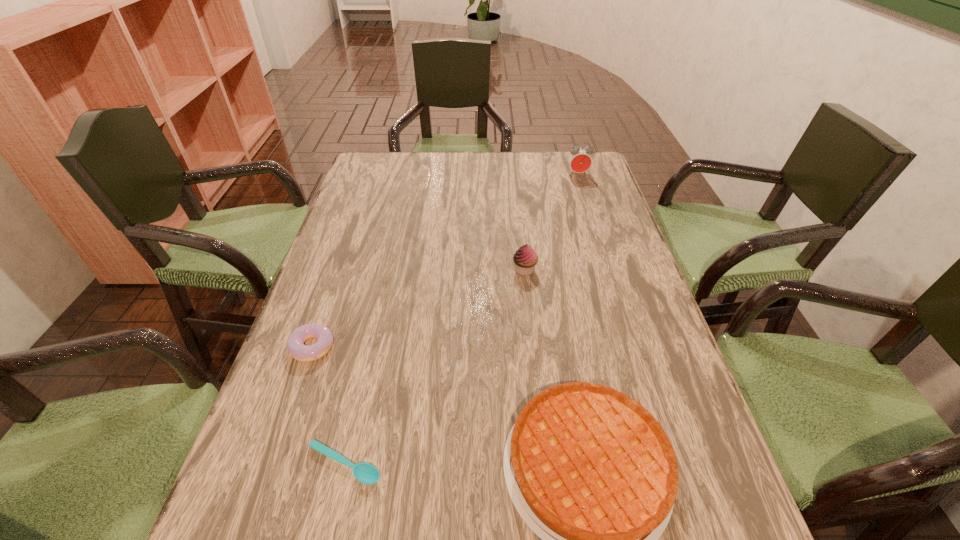
Locate an element on the screen. The image size is (960, 540). vacant area located on the front of the fourth tallest object is located at coordinates (276, 454).

Identify the location of vacant space located 0.370m on the right of the second object from left to right. (596, 464).

You are a GUI agent. You are given a task and a screenshot of the screen. Output one action in this format:
    pyautogui.click(x=<x>, y=<y>)
    Task: Click on the object that is positioned at the far edge
    Image resolution: width=960 pixels, height=540 pixels.
    Given the screenshot: What is the action you would take?
    pyautogui.click(x=579, y=159)

This screenshot has width=960, height=540. What are the coordinates of `doughnut situated at the left edge` in the screenshot? It's located at (295, 344).

Find the location of a particular element. This screenshot has height=540, width=960. spoon present at the left edge is located at coordinates (365, 473).

Image resolution: width=960 pixels, height=540 pixels. What are the coordinates of `object that is at the right edge` in the screenshot? It's located at (579, 159).

In order to click on object that is at the far right corner in this screenshot , I will do `click(579, 159)`.

In order to click on vacant space at the far edge of the desktop in this screenshot , I will do 537,164.

Locate an element on the screen. free space at the left edge of the desktop is located at coordinates (331, 305).

Locate an element on the screen. Image resolution: width=960 pixels, height=540 pixels. vacant region at the right edge is located at coordinates (647, 347).